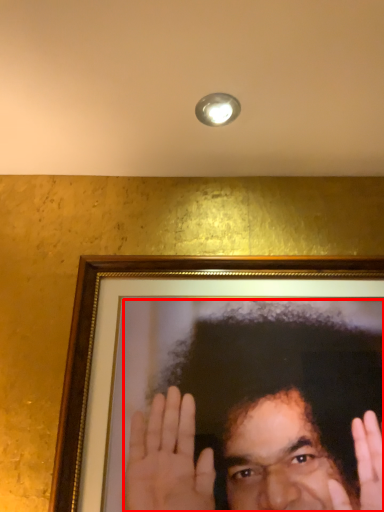
Question: Considering the relative positions of man (annotated by the red box) and light fixture in the image provided, where is man (annotated by the red box) located with respect to the staircase?

Choices:
 (A) left
 (B) right

Answer: (B)